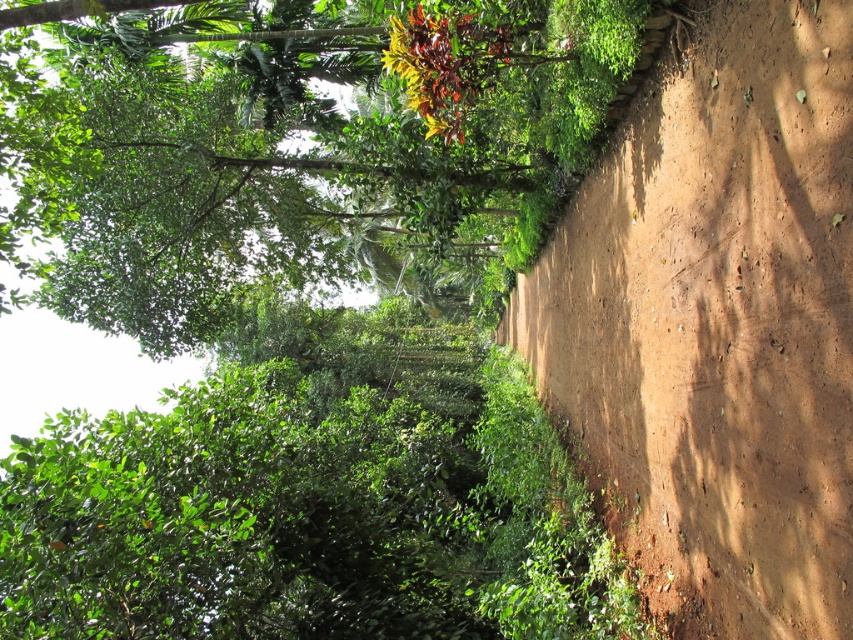
Who is positioned more to the right, green leafy bush at center or green leafy tree at center?

Positioned to the right is green leafy tree at center.

Is green leafy bush at center smaller than green leafy tree at center?

Indeed, green leafy bush at center has a smaller size compared to green leafy tree at center.

Find the location of `green leafy bush at center`. green leafy bush at center is located at coordinates (312, 499).